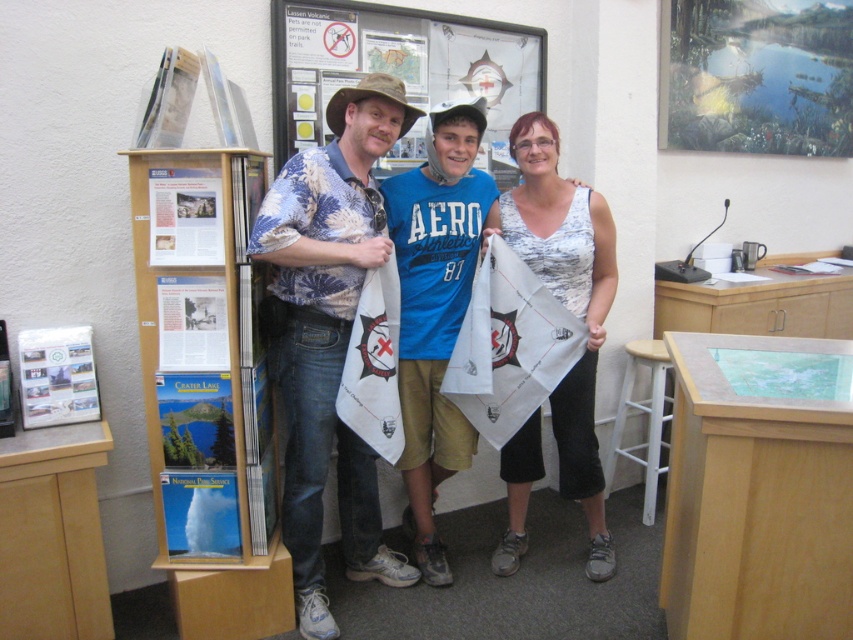
Question: Which point is closer to the camera taking this photo?

Choices:
 (A) (83, 412)
 (B) (171, 227)
 (C) (399, 33)

Answer: (B)

Question: Which object is positioned closest to the matte paper poster at left?

Choices:
 (A) white wood stool at lower right
 (B) metallic reflective poster at upper right

Answer: (A)

Question: From the image, what is the correct spatial relationship of white paper towel at center in relation to white paper at center?

Choices:
 (A) below
 (B) above

Answer: (A)

Question: Does white paper towel at center appear on the left side of white paper at left?

Choices:
 (A) yes
 (B) no

Answer: (B)

Question: Does blue cotton t-shirt at center appear over white wood stool at lower right?

Choices:
 (A) no
 (B) yes

Answer: (B)

Question: Which object is the closest to the white paper at left?

Choices:
 (A) metallic reflective poster at upper right
 (B) blue cotton t-shirt at center

Answer: (B)